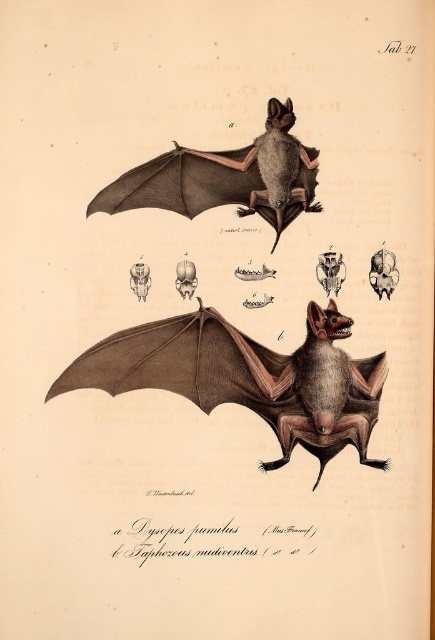
You are a researcher examining the illustration of bats. You notice two bats labeled as brown textured bat at center and brown matte bat at upper center. Based on their positions in the image, which bat is located lower on the page?

The brown textured bat at center is positioned under the brown matte bat at upper center, so it is located lower on the page.

You are examining the scientific illustration labeled Tab 27. You notice a brown textured bat at center. Where exactly is this bat positioned in the image?

The brown textured bat at center is located at point (247, 378).

You are a researcher examining the illustration of bats. You notice two bats labeled as brown textured bat at center and brown matte bat at upper center. Based on their positions in the image, which bat appears to be larger in height?

The brown textured bat at center is taller than the brown matte bat at upper center, so it appears larger in height.